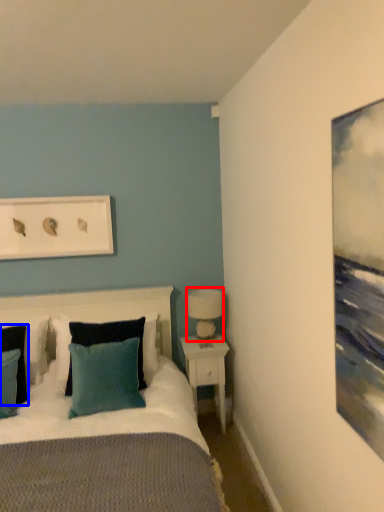
Question: Which of the following is the farthest to the observer, table lamp (highlighted by a red box) or pillow (highlighted by a blue box)?

Choices:
 (A) table lamp
 (B) pillow

Answer: (A)